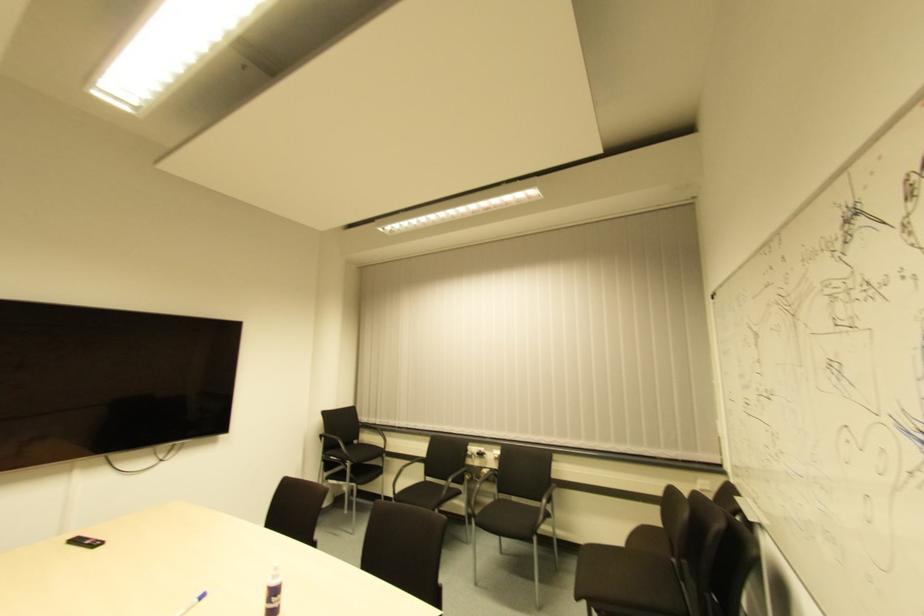
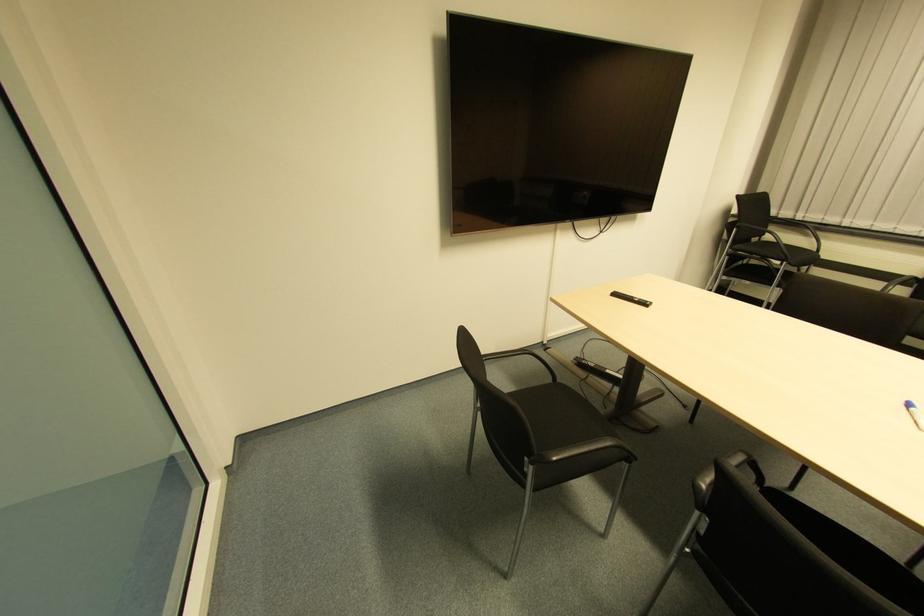
Question: I am providing you with two images of the same scene from different viewpoints. Which of the following objects are not visible in image2?

Choices:
 (A) black remote control
 (B) black chair armrest
 (C) black chair sitting surface
 (D) none of these

Answer: (D)